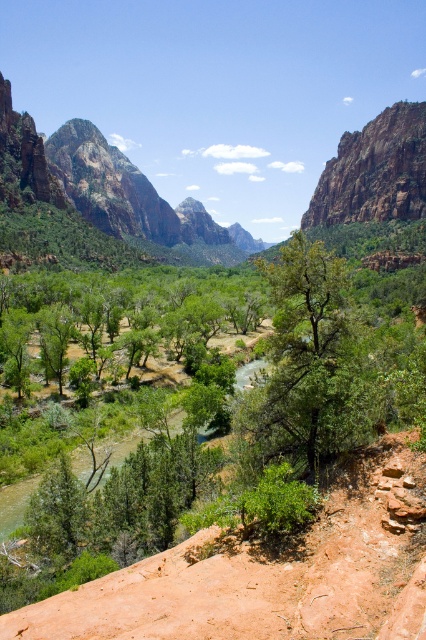
Between green leafy trees at center and rustic rock cliff at upper right, which one appears on the right side from the viewer's perspective?

rustic rock cliff at upper right is more to the right.

Find the location of a particular element. The width and height of the screenshot is (426, 640). green leafy trees at center is located at coordinates (141, 301).

What do you see at coordinates (313, 362) in the screenshot?
I see `green matte tree at center` at bounding box center [313, 362].

Find the location of a particular element. green matte tree at center is located at coordinates (313, 362).

Does green matte tree at center have a lesser width compared to rustic rock cliff at upper right?

Correct, green matte tree at center's width is less than rustic rock cliff at upper right's.

This screenshot has height=640, width=426. In order to click on green matte tree at center in this screenshot , I will do `click(313, 362)`.